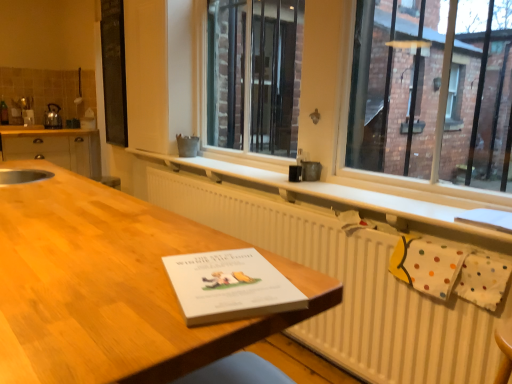
This screenshot has height=384, width=512. I want to click on vacant point above white textured radiator at center (from a real-world perspective), so click(x=272, y=196).